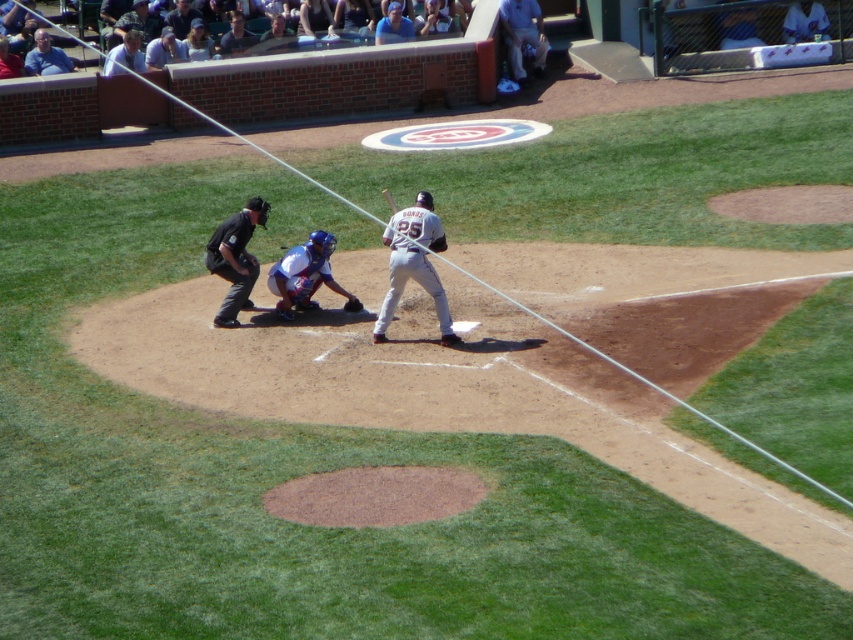
You are a GUI agent. You are given a task and a screenshot of the screen. Output one action in this format:
    pyautogui.click(x=<x>, y=<y>)
    Task: Click on the blue matte catcher at center
    Image resolution: width=853 pixels, height=640 pixels.
    Given the screenshot: What is the action you would take?
    pyautogui.click(x=303, y=275)

Is blue matte catcher at center further to camera compared to brown leather glove at center?

No, blue matte catcher at center is closer to the viewer.

This screenshot has height=640, width=853. I want to click on blue matte catcher at center, so click(x=303, y=275).

Can you confirm if black uniform at center is wider than blue fabric shirt at upper center?

No.

Is black uniform at center in front of blue fabric shirt at upper center?

Yes, it is.

You are a GUI agent. You are given a task and a screenshot of the screen. Output one action in this format:
    pyautogui.click(x=<x>, y=<y>)
    Task: Click on the black uniform at center
    The image size is (853, 640).
    Given the screenshot: What is the action you would take?
    pyautogui.click(x=235, y=259)

Which of these two, light blue shirt at upper center or dark blue uniform at upper center, stands shorter?

dark blue uniform at upper center

Between light blue shirt at upper center and dark blue uniform at upper center, which one has more height?

light blue shirt at upper center is taller.

Who is more distant from viewer, (144, 48) or (170, 10)?

The point (170, 10) is more distant.

The image size is (853, 640). I want to click on light blue shirt at upper center, so click(x=164, y=49).